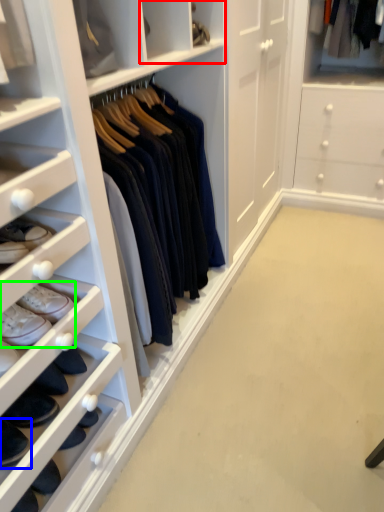
Question: Considering the real-world distances, which object is farthest from cabinet (highlighted by a red box)? footwear (highlighted by a blue box) or footwear (highlighted by a green box)?

Choices:
 (A) footwear
 (B) footwear

Answer: (A)